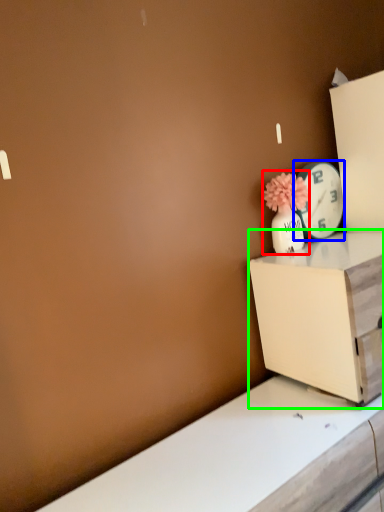
Question: Which is farther away from floral arrangement (highlighted by a red box)? clock (highlighted by a blue box) or nightstand (highlighted by a green box)?

Choices:
 (A) clock
 (B) nightstand

Answer: (B)